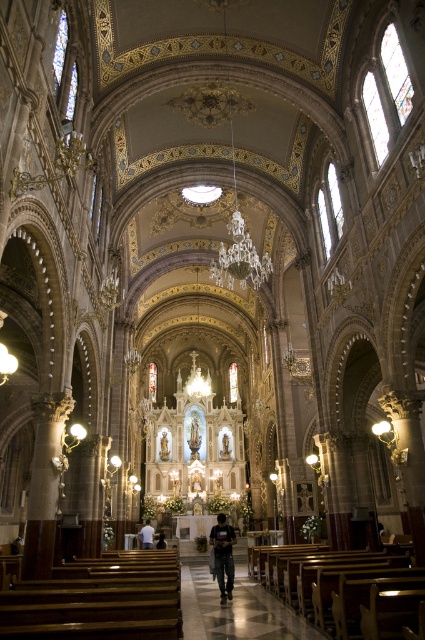
You are a photographer standing at the entrance of the cathedral. You want to take a photo that includes both the black cotton shirt at center and the white fabric shirt at center. Which shirt will appear wider in the photo?

The white fabric shirt at center will appear wider in the photo since it has a greater width compared to the black cotton shirt at center.